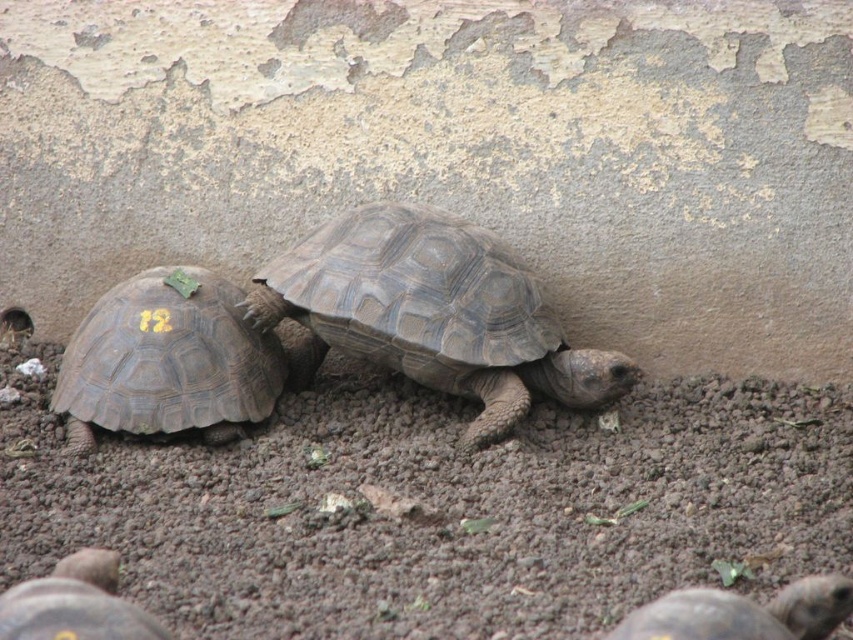
Question: Among these points, which one is nearest to the camera?

Choices:
 (A) coord(86,632)
 (B) coord(801,605)

Answer: (A)

Question: Which point is closer to the camera taking this photo?

Choices:
 (A) (589, 392)
 (B) (210, 442)

Answer: (B)

Question: Can you confirm if brown textured shell at left is wider than brown textured shell at center?

Choices:
 (A) no
 (B) yes

Answer: (B)

Question: Is brown textured shell at left bigger than brown textured shell at center?

Choices:
 (A) yes
 (B) no

Answer: (A)

Question: Does dark brown textured shell at center have a lesser width compared to brown textured shell at left?

Choices:
 (A) yes
 (B) no

Answer: (B)

Question: Estimate the real-world distances between objects in this image. Which object is closer to the brown textured shell at left?

Choices:
 (A) brown textured shell at center
 (B) dark brown textured shell at center
 (C) dark brown shell at lower left

Answer: (B)